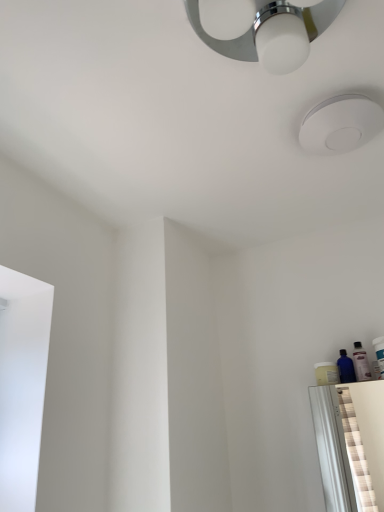
Question: Is white plastic toothbrush at right, which ranks as the second toiletry in left-to-right order, taller or shorter than white matte droplight at upper center?

Choices:
 (A) short
 (B) tall

Answer: (B)

Question: Considering the relative positions of white plastic toothbrush at right, which ranks as the second toiletry in left-to-right order, and white matte droplight at upper center in the image provided, is white plastic toothbrush at right, which ranks as the second toiletry in left-to-right order, to the left or to the right of white matte droplight at upper center?

Choices:
 (A) left
 (B) right

Answer: (B)

Question: Which of these objects is positioned closest to the transparent plastic bottle at right?

Choices:
 (A) translucent plastic bottle at right, acting as the 2th toiletry starting from the right
 (B) white plastic toothbrush at right, which ranks as the second toiletry in left-to-right order
 (C) white matte droplight at upper center

Answer: (A)

Question: Which of these objects is positioned farthest from the white matte droplight at upper center?

Choices:
 (A) translucent plastic bottle at right, acting as the 2th toiletry starting from the right
 (B) transparent plastic bottle at right
 (C) white plastic toothbrush at right, which ranks as the second toiletry in left-to-right order

Answer: (B)